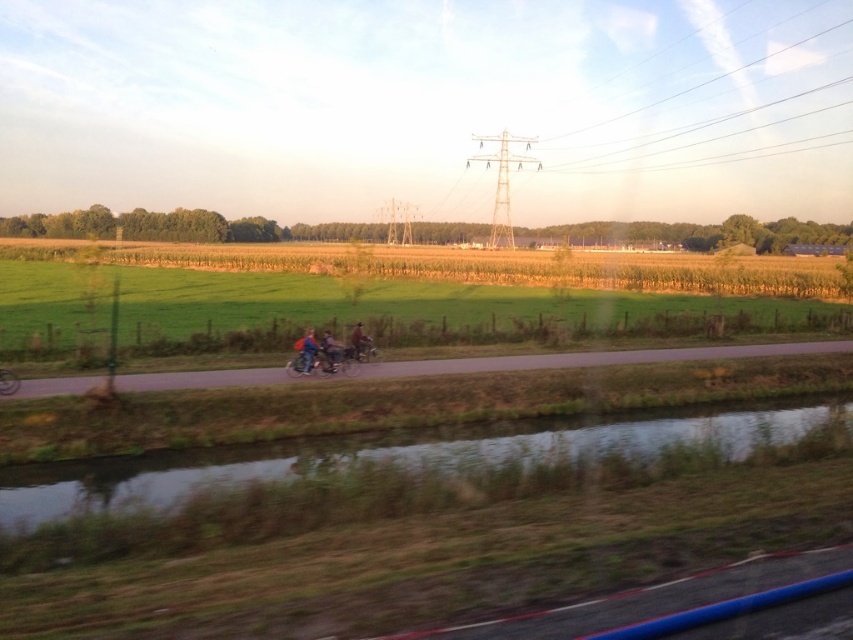
You are a pedestrian standing on the road and want to cross to the other side. The road is narrow. The green grassy water at lower center and the shiny metallic motorcycle at center are both on the road. Which one should you avoid stepping on to safely cross?

You should avoid stepping on the green grassy water at lower center because its width is larger than the shiny metallic motorcycle at center, making it more dangerous to step on.

You are standing at the point closer to the camera between the two points, point [141,326] and point [97,502]. Which point are you standing at?

You are standing at point [141,326] because it is further to the camera than point [97,502].